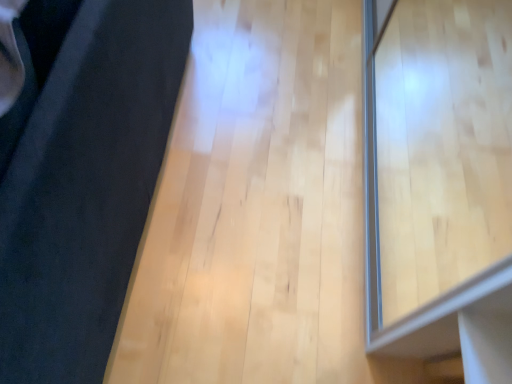
You are a GUI agent. You are given a task and a screenshot of the screen. Output one action in this format:
    pyautogui.click(x=<x>, y=<y>)
    Task: Click on the black fabric at left
    
    Given the screenshot: What is the action you would take?
    pos(81,175)

The width and height of the screenshot is (512, 384). What do you see at coordinates (81, 175) in the screenshot? I see `black fabric at left` at bounding box center [81, 175].

The height and width of the screenshot is (384, 512). I want to click on transparent glass window at right, so click(439, 182).

Describe the element at coordinates (439, 182) in the screenshot. I see `transparent glass window at right` at that location.

Identify the location of black fabric at left. [x=81, y=175].

Considering the positions of objects transparent glass window at right and black fabric at left in the image provided, who is more to the right, transparent glass window at right or black fabric at left?

transparent glass window at right.

Considering the relative positions of transparent glass window at right and black fabric at left in the image provided, is transparent glass window at right behind black fabric at left?

Yes, it is.

Is point (455, 99) more distant than point (6, 250)?

Yes, point (455, 99) is farther from viewer.

From the image's perspective, which one is positioned higher, transparent glass window at right or black fabric at left?

From the image's view, black fabric at left is above.

From a real-world perspective, is transparent glass window at right beneath black fabric at left?

Incorrect, from a real-world perspective, transparent glass window at right is higher than black fabric at left.

Is transparent glass window at right thinner than black fabric at left?

Yes.

Considering the relative sizes of transparent glass window at right and black fabric at left in the image provided, is transparent glass window at right taller than black fabric at left?

Incorrect, the height of transparent glass window at right is not larger of that of black fabric at left.

Who is smaller, transparent glass window at right or black fabric at left?

Smaller between the two is transparent glass window at right.

Is transparent glass window at right spatially inside black fabric at left, or outside of it?

transparent glass window at right lies outside black fabric at left.

Is transparent glass window at right far away from black fabric at left?

That's not correct — transparent glass window at right is a little close to black fabric at left.

Is transparent glass window at right positioned with its back to black fabric at left?

No, transparent glass window at right is not facing away from black fabric at left.

Measure the distance from transparent glass window at right to black fabric at left.

transparent glass window at right and black fabric at left are 91.57 centimeters apart from each other.

Image resolution: width=512 pixels, height=384 pixels. Identify the location of furniture in front of the transparent glass window at right. (81, 175).

Would you say black fabric at left is to the left or to the right of transparent glass window at right in the picture?

Clearly, black fabric at left is on the left of transparent glass window at right in the image.

Which is in front, black fabric at left or transparent glass window at right?

Positioned in front is black fabric at left.

Considering the points (115, 45) and (400, 164), which point is in front, point (115, 45) or point (400, 164)?

The point (115, 45) is in front.

From the image's perspective, which is below, black fabric at left or transparent glass window at right?

transparent glass window at right.

From a real-world perspective, is black fabric at left physically above transparent glass window at right?

Incorrect, from a real-world perspective, black fabric at left is lower than transparent glass window at right.

In terms of width, does black fabric at left look wider or thinner when compared to transparent glass window at right?

In the image, black fabric at left appears to be wider than transparent glass window at right.

Between black fabric at left and transparent glass window at right, which one has more height?

black fabric at left.

Can you confirm if black fabric at left is bigger than transparent glass window at right?

Yes, black fabric at left is bigger than transparent glass window at right.

Which is correct: black fabric at left is inside transparent glass window at right, or outside of it?

black fabric at left exists outside the volume of transparent glass window at right.

Would you consider black fabric at left to be distant from transparent glass window at right?

No, black fabric at left is not far away from transparent glass window at right.

Could you tell me if black fabric at left is turned towards transparent glass window at right?

No.

Locate an element on the screen. The height and width of the screenshot is (384, 512). window on the right of black fabric at left is located at coordinates [439, 182].

The height and width of the screenshot is (384, 512). Identify the location of furniture on the left of transparent glass window at right. (81, 175).

Locate an element on the screen. Image resolution: width=512 pixels, height=384 pixels. window that appears above the black fabric at left (from a real-world perspective) is located at coordinates (439, 182).